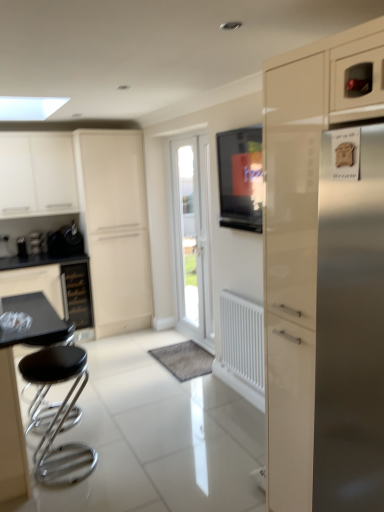
Question: From a real-world perspective, is satin black coffee machine at left positioned over metallic black kettle at left based on gravity?

Choices:
 (A) yes
 (B) no

Answer: (B)

Question: Is the position of satin black coffee machine at left less distant than that of metallic black kettle at left?

Choices:
 (A) yes
 (B) no

Answer: (B)

Question: Considering the relative sizes of satin black coffee machine at left and metallic black kettle at left in the image provided, is satin black coffee machine at left shorter than metallic black kettle at left?

Choices:
 (A) no
 (B) yes

Answer: (B)

Question: Is metallic black kettle at left inside satin black coffee machine at left?

Choices:
 (A) no
 (B) yes

Answer: (A)

Question: Considering the relative sizes of satin black coffee machine at left and metallic black kettle at left in the image provided, is satin black coffee machine at left thinner than metallic black kettle at left?

Choices:
 (A) yes
 (B) no

Answer: (A)

Question: From the image's perspective, is white glossy cabinet at upper left, the second cabinetry from the front, located above or below white glossy door at center?

Choices:
 (A) above
 (B) below

Answer: (A)

Question: From a real-world perspective, is white glossy cabinet at upper left, the second cabinetry in the right-to-left sequence, positioned above or below white glossy door at center?

Choices:
 (A) below
 (B) above

Answer: (B)

Question: Considering the positions of white glossy cabinet at upper left, the 1th cabinetry positioned from the back, and white glossy door at center in the image, is white glossy cabinet at upper left, the 1th cabinetry positioned from the back, bigger or smaller than white glossy door at center?

Choices:
 (A) small
 (B) big

Answer: (B)

Question: Is white glossy cabinet at upper left, the second cabinetry from the front, wider or thinner than white glossy door at center?

Choices:
 (A) wide
 (B) thin

Answer: (A)

Question: Is black glass drawer at lower left wider or thinner than glossy cream cabinet at right, arranged as the 1th cabinetry when viewed from the right?

Choices:
 (A) thin
 (B) wide

Answer: (A)

Question: In terms of height, does black glass drawer at lower left look taller or shorter compared to glossy cream cabinet at right, arranged as the 1th cabinetry when viewed from the right?

Choices:
 (A) short
 (B) tall

Answer: (A)

Question: From the image's perspective, is black glass drawer at lower left located above or below glossy cream cabinet at right, which appears as the 2th cabinetry when viewed from the back?

Choices:
 (A) above
 (B) below

Answer: (B)

Question: From a real-world perspective, relative to glossy cream cabinet at right, arranged as the 1th cabinetry when viewed from the right, is black glass drawer at lower left vertically above or below?

Choices:
 (A) below
 (B) above

Answer: (A)

Question: Is black glass drawer at lower left taller or shorter than metallic black kettle at left?

Choices:
 (A) short
 (B) tall

Answer: (B)

Question: Visually, is black glass drawer at lower left positioned to the left or to the right of metallic black kettle at left?

Choices:
 (A) left
 (B) right

Answer: (A)